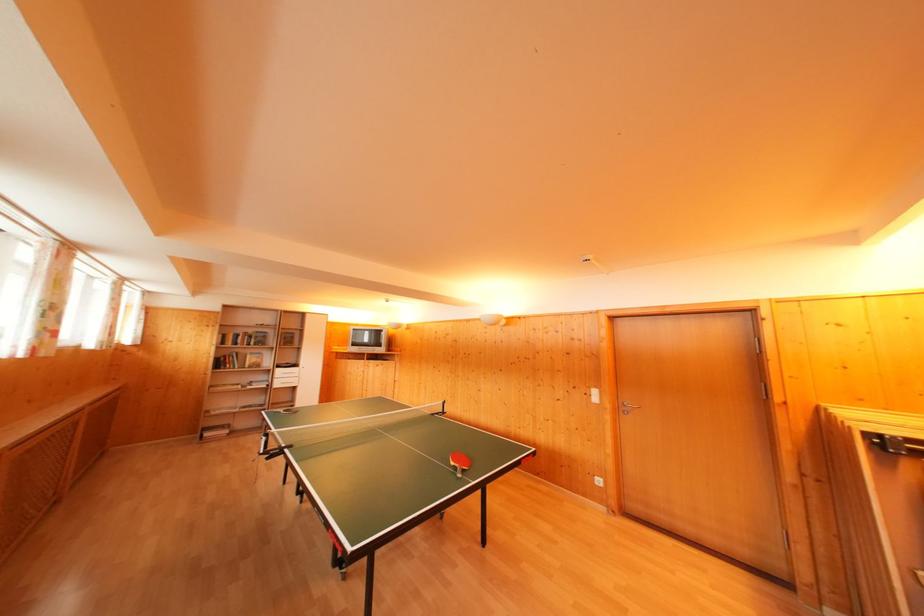
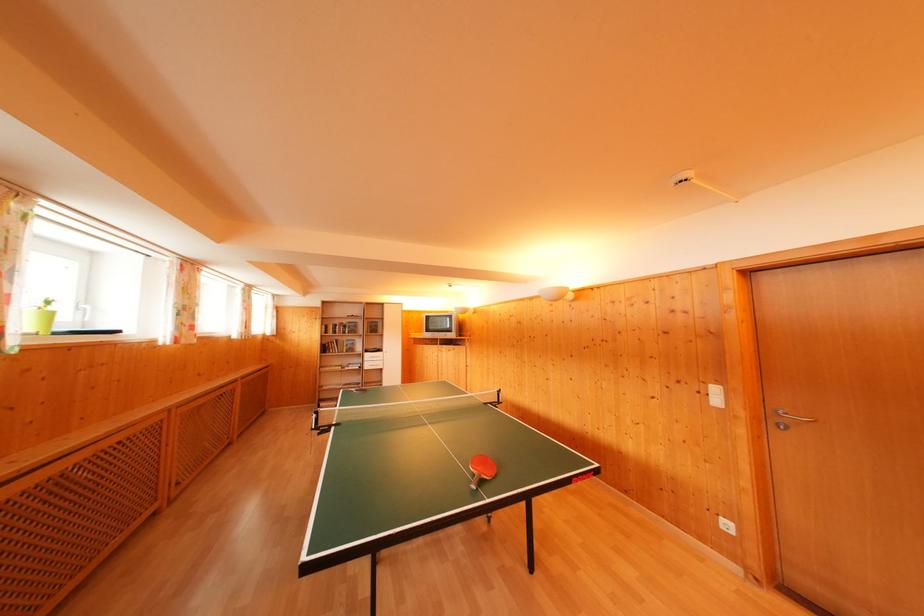
In the second image, find the point that corresponds to [256,336] in the first image.

(349, 326)